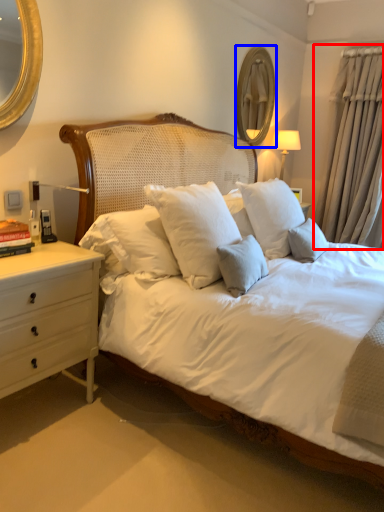
Question: Which object is further to the camera taking this photo, curtain (highlighted by a red box) or mirror (highlighted by a blue box)?

Choices:
 (A) curtain
 (B) mirror

Answer: (A)